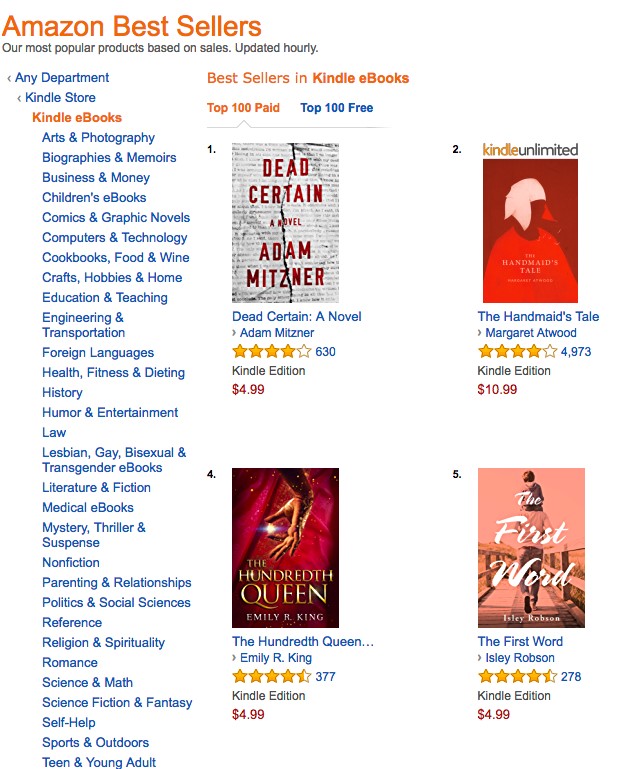
The height and width of the screenshot is (769, 622). In order to click on book covers in this screenshot , I will do `click(297, 218)`, `click(531, 235)`, `click(531, 548)`, `click(322, 571)`.